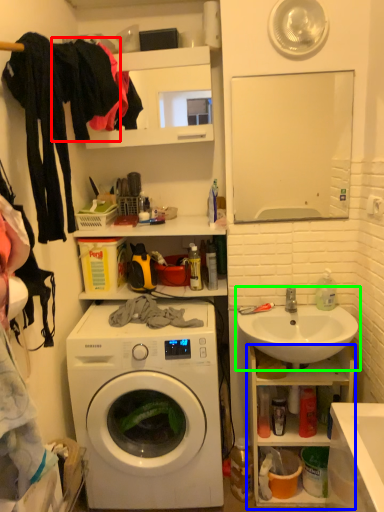
Question: Which object is the farthest from clothing (highlighted by a red box)? Choose among these: cabinet (highlighted by a blue box) or sink (highlighted by a green box).

Choices:
 (A) cabinet
 (B) sink

Answer: (A)